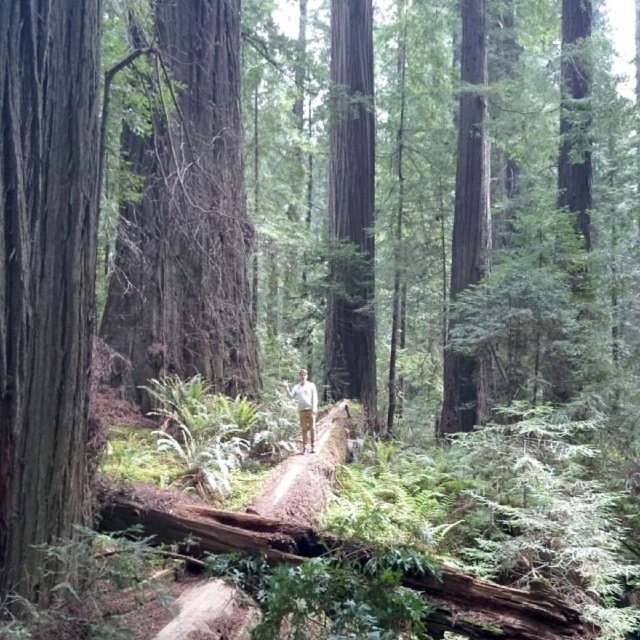
Question: Is dark brown bark tree at center bigger than white cotton shirt at center?

Choices:
 (A) yes
 (B) no

Answer: (A)

Question: Which point is farther to the camera?

Choices:
 (A) pyautogui.click(x=164, y=180)
 (B) pyautogui.click(x=20, y=592)

Answer: (A)

Question: Which object is closer to the camera taking this photo?

Choices:
 (A) smooth dark brown tree trunk at center
 (B) dark brown bark tree at center
 (C) white cotton shirt at center
 (D) brown dirt trail at center

Answer: (D)

Question: Estimate the real-world distances between objects in this image. Which object is farther from the smooth brown tree trunk at left?

Choices:
 (A) brown dirt trail at center
 (B) white cotton shirt at center
 (C) smooth dark brown tree trunk at center

Answer: (C)

Question: Is smooth dark brown tree trunk at center positioned in front of white cotton shirt at center?

Choices:
 (A) yes
 (B) no

Answer: (B)

Question: Considering the relative positions of smooth brown tree trunk at left and dark brown bark tree at center in the image provided, where is smooth brown tree trunk at left located with respect to dark brown bark tree at center?

Choices:
 (A) above
 (B) below

Answer: (B)